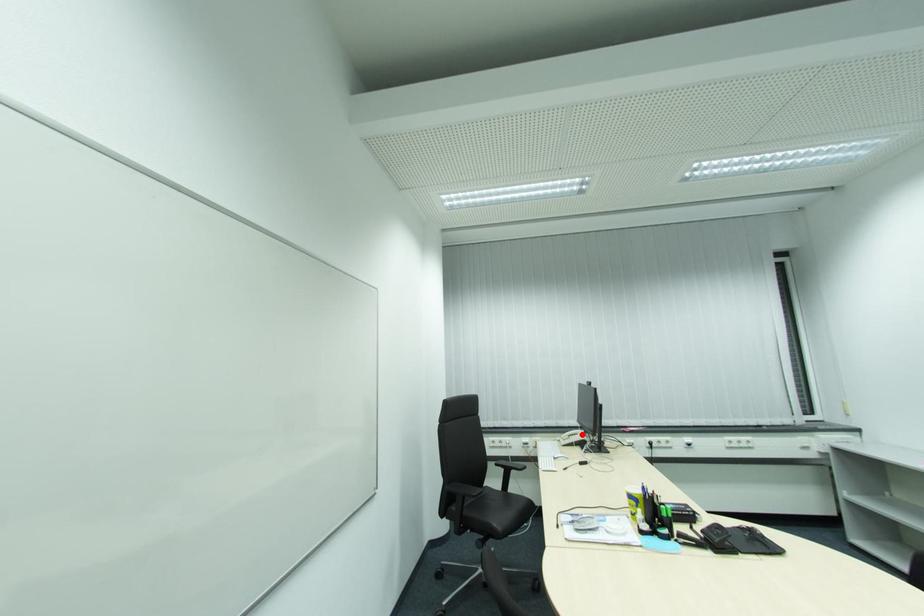
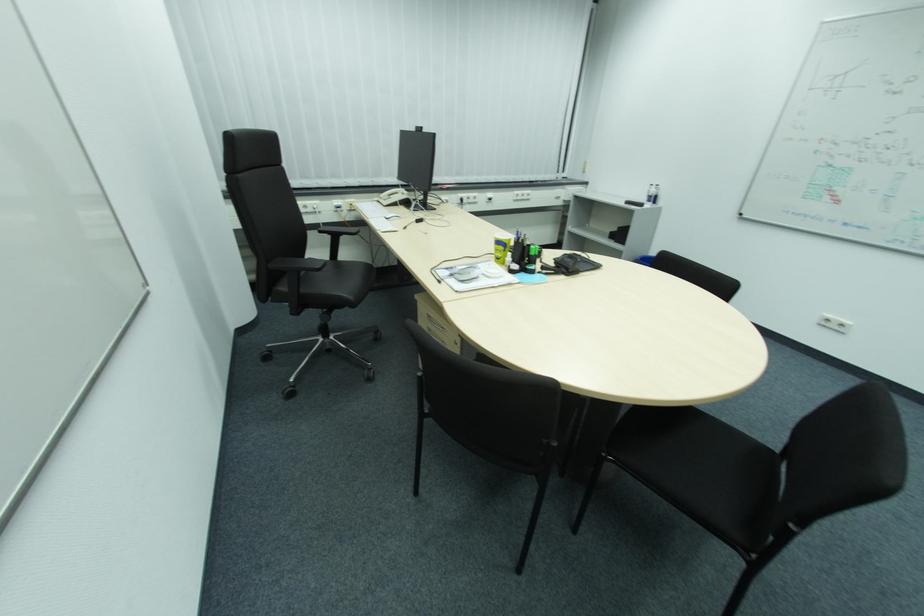
The point at the highlighted location is marked in the first image. Where is the corresponding point in the second image?

(403, 193)